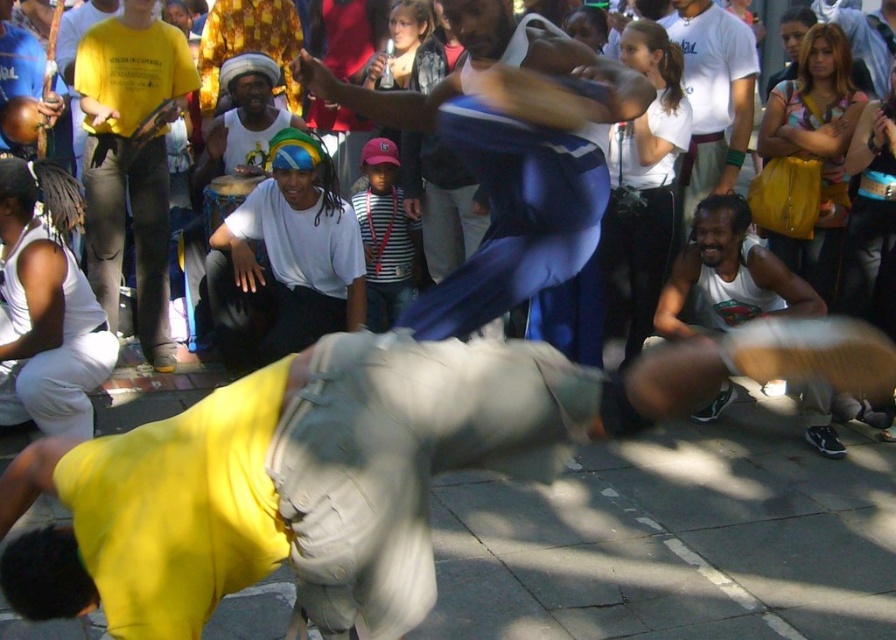
Is white cotton tank top at left taller than striped fabric shirt at center?

Yes.

Describe the element at coordinates (46, 307) in the screenshot. Image resolution: width=896 pixels, height=640 pixels. I see `white cotton tank top at left` at that location.

Does point (6, 177) lie in front of point (373, 180)?

Yes, point (6, 177) is closer to viewer.

Where is `white cotton tank top at left`? Image resolution: width=896 pixels, height=640 pixels. white cotton tank top at left is located at coordinates (46, 307).

Based on the photo, who is shorter, blue fabric pants at center or striped fabric shirt at center?

striped fabric shirt at center

Is blue fabric pants at center bigger than striped fabric shirt at center?

Indeed, blue fabric pants at center has a larger size compared to striped fabric shirt at center.

Which is behind, point (316, 65) or point (366, 196)?

Positioned behind is point (366, 196).

Image resolution: width=896 pixels, height=640 pixels. I want to click on blue fabric pants at center, so click(515, 170).

Does point (510, 77) come closer to viewer compared to point (797, 225)?

That is True.

Looking at this image, measure the distance between blue fabric pants at center and camera.

blue fabric pants at center and camera are 12.43 feet apart from each other.

Between point (406, 308) and point (784, 80), which one is positioned behind?

The point (784, 80) is behind.

Locate an element on the screen. The image size is (896, 640). blue fabric pants at center is located at coordinates (515, 170).